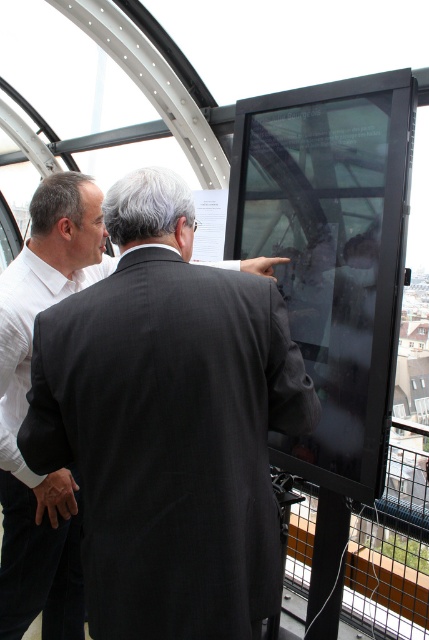
Which is more to the left, black wool suit at center or white shirt at left?

Positioned to the left is white shirt at left.

Does point (217, 404) come closer to viewer compared to point (78, 280)?

Yes, point (217, 404) is closer to viewer.

This screenshot has height=640, width=429. I want to click on black wool suit at center, so click(x=169, y=440).